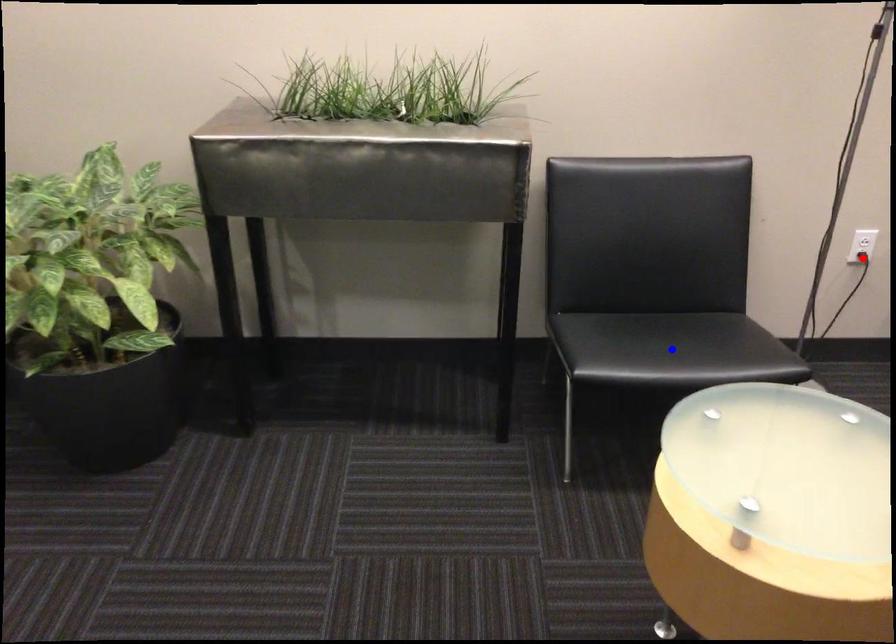
Question: Which of the two points in the image is closer to the camera?

Choices:
 (A) Blue point is closer.
 (B) Red point is closer.

Answer: (A)